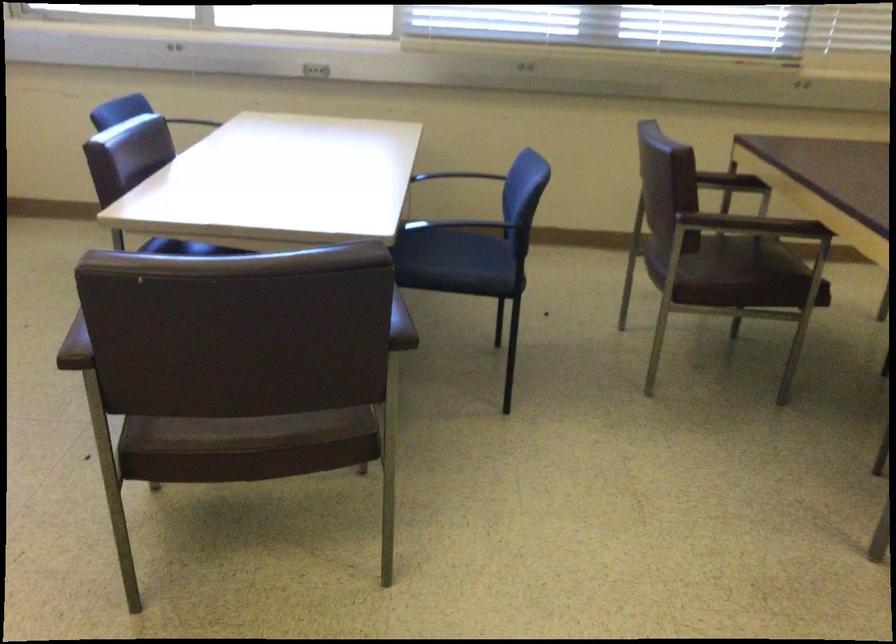
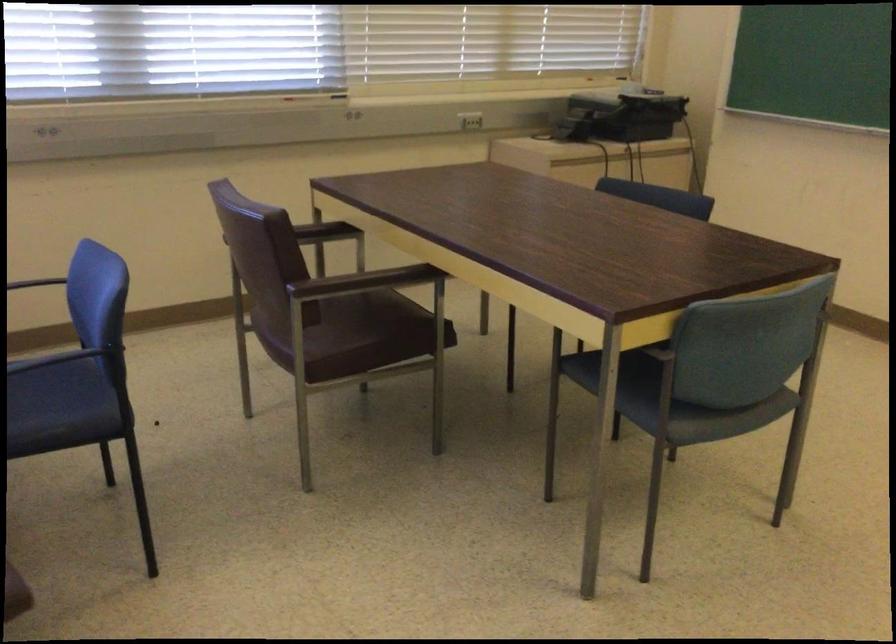
Question: The images are taken continuously from a first-person perspective. In which direction is your viewpoint rotating?

Choices:
 (A) Left
 (B) Right
 (C) Up
 (D) Down

Answer: (B)